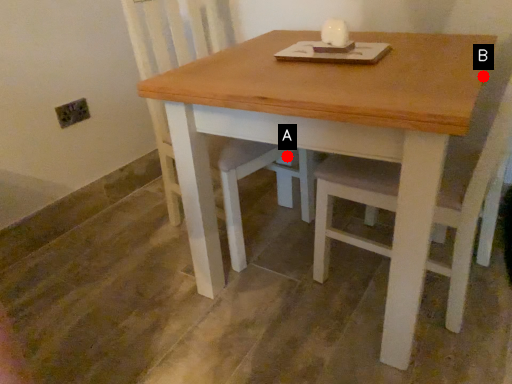
Question: Two points are circled on the image, labeled by A and B beside each circle. Which point appears farthest from the camera in this image?

Choices:
 (A) A is further
 (B) B is further

Answer: (A)